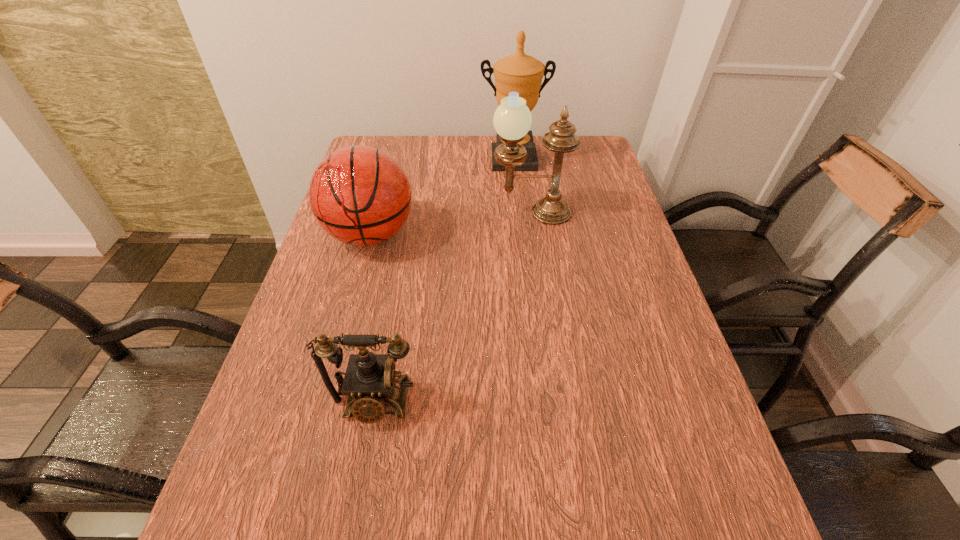
The height and width of the screenshot is (540, 960). What are the coordinates of `unoccupied position between the basketball and the oil lamp` in the screenshot? It's located at (450, 224).

Find the location of a particular element. This screenshot has width=960, height=540. free spot between the oil lamp and the shortest object is located at coordinates (452, 308).

Find the location of a particular element. The image size is (960, 540). blank region between the award and the oil lamp is located at coordinates (x=521, y=186).

Locate an element on the screen. Image resolution: width=960 pixels, height=540 pixels. free space between the farthest object and the basketball is located at coordinates (442, 197).

You are a GUI agent. You are given a task and a screenshot of the screen. Output one action in this format:
    pyautogui.click(x=<x>, y=<y>)
    Task: Click on the free area in between the farthest object and the third tallest object
    This screenshot has width=960, height=540.
    Given the screenshot: What is the action you would take?
    pyautogui.click(x=442, y=197)

What are the coordinates of `free space between the basketball and the oil lamp` in the screenshot? It's located at (450, 224).

Locate an element on the screen. vacant area that lies between the farthest object and the oil lamp is located at coordinates (521, 186).

Locate which object is the third closest to the nearest object. Please provide its 2D coordinates. Your answer should be formatted as a tuple, i.e. [(x, y)], where the tuple contains the x and y coordinates of a point satisfying the conditions above.

[(521, 73)]

This screenshot has height=540, width=960. In order to click on the second closest object to the basketball in this screenshot , I will do `click(521, 73)`.

The width and height of the screenshot is (960, 540). What are the coordinates of `free location that satisfies the following two spatial constraints: 1. at the front of the farthest object with handles; 2. on the right side of the oil lamp` in the screenshot? It's located at (518, 213).